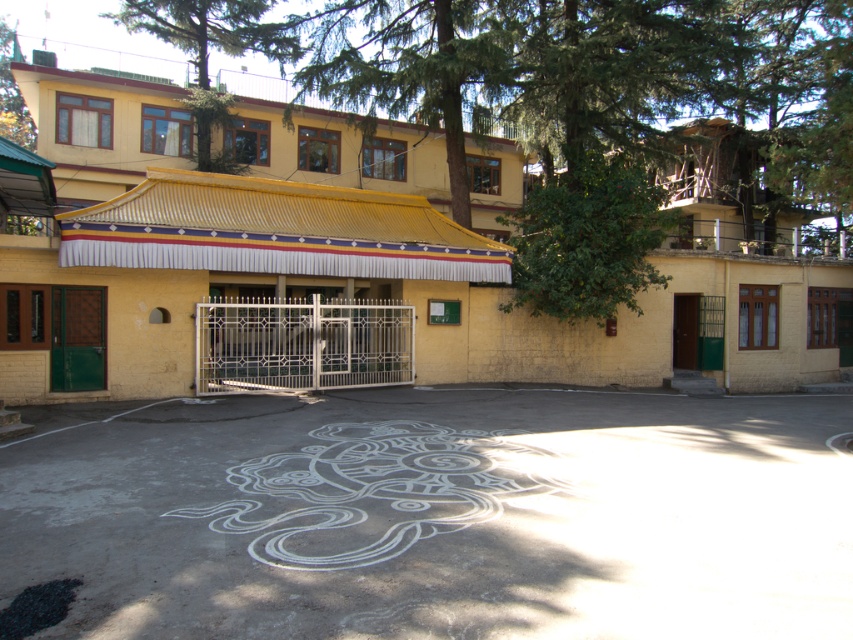
Question: Is white chalk drawing at center above green wooden door at left?

Choices:
 (A) no
 (B) yes

Answer: (A)

Question: Can you confirm if white chalk drawing at center is positioned above green wooden door at left?

Choices:
 (A) yes
 (B) no

Answer: (B)

Question: Which object is closer to the camera taking this photo?

Choices:
 (A) white chalk drawing at center
 (B) brown wooden door at center
 (C) green wooden door at left

Answer: (A)

Question: Which of the following is the farthest from the observer?

Choices:
 (A) (91, 324)
 (B) (688, 301)
 (C) (544, 486)

Answer: (B)

Question: Is white chalk drawing at center thinner than green wooden door at left?

Choices:
 (A) no
 (B) yes

Answer: (A)

Question: Which object is farther from the camera taking this photo?

Choices:
 (A) green wooden door at left
 (B) brown wooden door at center
 (C) white chalk drawing at center

Answer: (B)